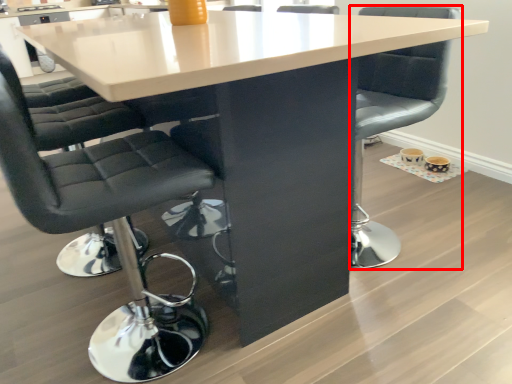
Question: From the image's perspective, considering the relative positions of chair (annotated by the red box) and chair in the image provided, where is chair (annotated by the red box) located with respect to the staircase?

Choices:
 (A) above
 (B) below

Answer: (A)